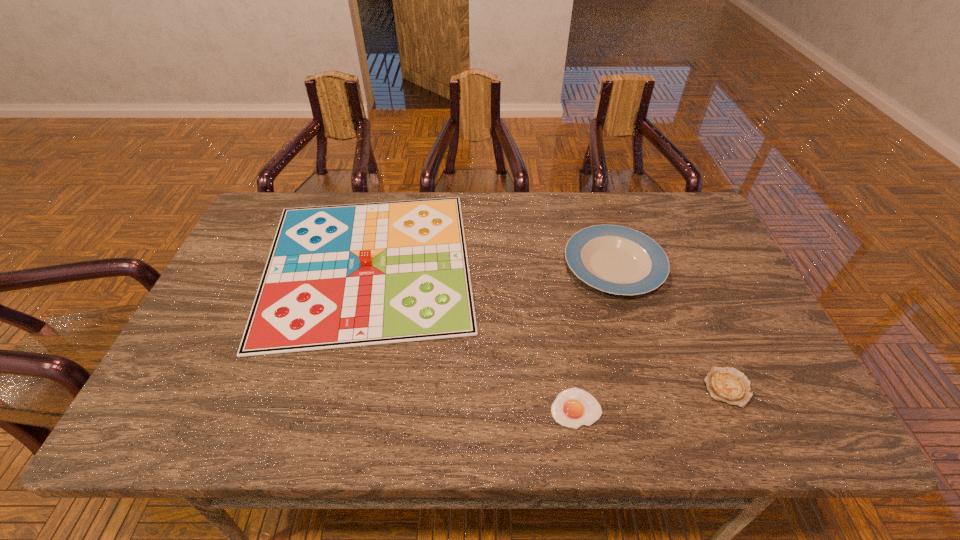
You are a GUI agent. You are given a task and a screenshot of the screen. Output one action in this format:
    pyautogui.click(x=<x>, y=<y>)
    Task: Click on the free space between the quiche and the egg yolk
    
    Given the screenshot: What is the action you would take?
    pyautogui.click(x=652, y=398)

You are a GUI agent. You are given a task and a screenshot of the screen. Output one action in this format:
    pyautogui.click(x=<x>, y=<y>)
    Task: Click on the vacant area that lies between the third tallest object and the egg yolk
    
    Given the screenshot: What is the action you would take?
    pyautogui.click(x=652, y=398)

Image resolution: width=960 pixels, height=540 pixels. Find the location of `free spot between the tallest object and the plate`. free spot between the tallest object and the plate is located at coordinates (491, 265).

Identify the location of vacant space in between the third tallest object and the plate. Image resolution: width=960 pixels, height=540 pixels. (671, 327).

Identify which object is located as the nearest to the plate. Please provide its 2D coordinates. Your answer should be formatted as a tuple, i.e. [(x, y)], where the tuple contains the x and y coordinates of a point satisfying the conditions above.

[(728, 385)]

Where is `object that is the third closest to the second shortest object`? This screenshot has height=540, width=960. object that is the third closest to the second shortest object is located at coordinates (337, 276).

What are the coordinates of `vacant position in the image that satisfies the following two spatial constraints: 1. on the front side of the shortest object; 2. on the left side of the leftmost object` in the screenshot? It's located at (331, 408).

Locate an element on the screen. The image size is (960, 540). vacant area that satisfies the following two spatial constraints: 1. on the back side of the third shortest object; 2. on the left side of the shortest object is located at coordinates (553, 266).

Find the location of a particular element. free region that satisfies the following two spatial constraints: 1. on the front side of the egg yolk; 2. on the right side of the tallest object is located at coordinates (331, 408).

Where is `free space that satisfies the following two spatial constraints: 1. on the back side of the quiche; 2. on the left side of the shortest object`? This screenshot has height=540, width=960. free space that satisfies the following two spatial constraints: 1. on the back side of the quiche; 2. on the left side of the shortest object is located at coordinates (572, 388).